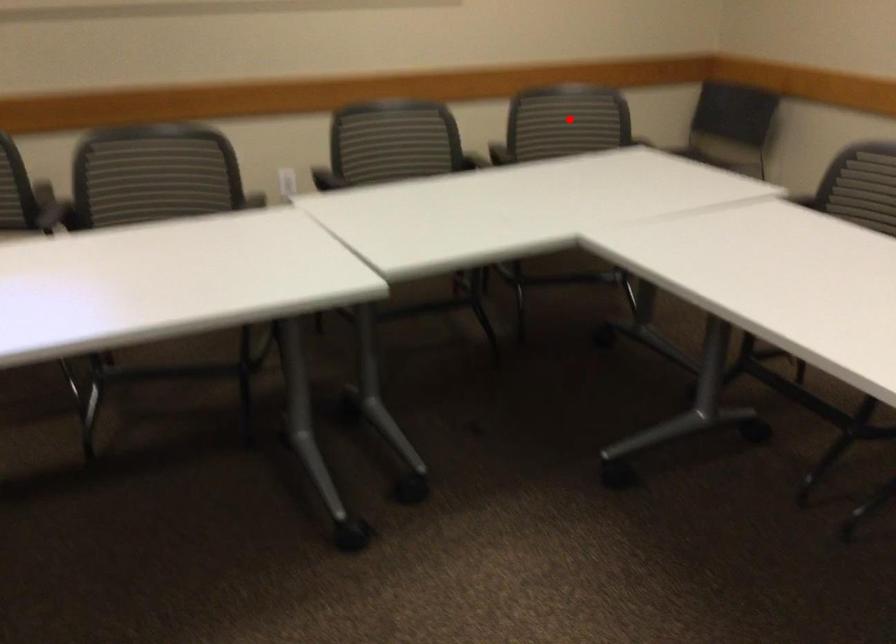
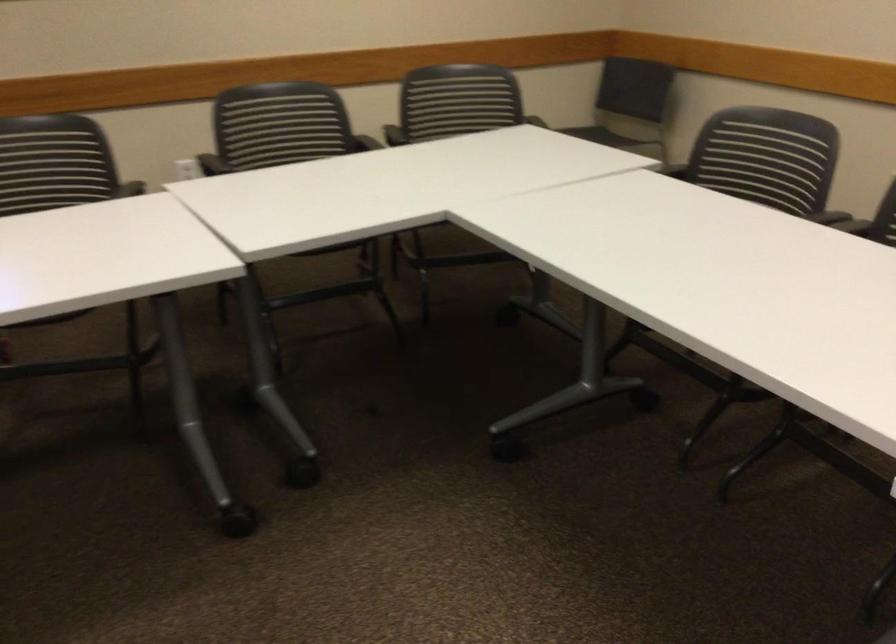
The point at the highlighted location is marked in the first image. Where is the corresponding point in the second image?

(455, 100)